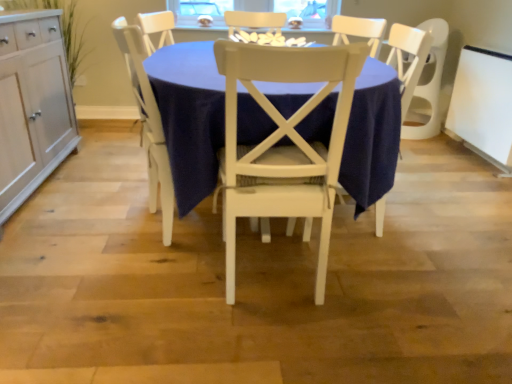
Question: Could you tell me if white glossy cookies at center is turned towards white wood chair at center?

Choices:
 (A) no
 (B) yes

Answer: (A)

Question: From a real-world perspective, is white glossy cookies at center positioned under white wood chair at center based on gravity?

Choices:
 (A) no
 (B) yes

Answer: (A)

Question: Is white glossy cookies at center oriented away from white wood chair at center?

Choices:
 (A) no
 (B) yes

Answer: (A)

Question: Can you confirm if white glossy cookies at center is smaller than white wood chair at center?

Choices:
 (A) no
 (B) yes

Answer: (B)

Question: Is there a large distance between white glossy cookies at center and white wood chair at center?

Choices:
 (A) no
 (B) yes

Answer: (A)

Question: From their relative heights in the image, would you say white wood chair at center is taller or shorter than white painted wood chair at center, placed as the 2th chair when sorted from left to right?

Choices:
 (A) short
 (B) tall

Answer: (B)

Question: From a real-world perspective, is white wood chair at center above or below white painted wood chair at center, placed as the 2th chair when sorted from left to right?

Choices:
 (A) above
 (B) below

Answer: (B)

Question: From the image's perspective, is white wood chair at center positioned above or below white painted wood chair at center, placed as the 2th chair when sorted from left to right?

Choices:
 (A) below
 (B) above

Answer: (B)

Question: In the image, is white wood chair at center on the left side or the right side of white painted wood chair at center, arranged as the 1th chair when viewed from the right?

Choices:
 (A) left
 (B) right

Answer: (B)

Question: From their relative heights in the image, would you say white wood chair at center is taller or shorter than white wood cabinet at left?

Choices:
 (A) tall
 (B) short

Answer: (A)

Question: From the image's perspective, is white wood chair at center located above or below white wood cabinet at left?

Choices:
 (A) below
 (B) above

Answer: (A)

Question: Is point pyautogui.click(x=404, y=49) closer or farther from the camera than point pyautogui.click(x=33, y=188)?

Choices:
 (A) closer
 (B) farther

Answer: (A)

Question: Is white wood chair at center in front of or behind white wood cabinet at left in the image?

Choices:
 (A) front
 (B) behind

Answer: (B)

Question: In terms of height, does white glossy cookies at center look taller or shorter compared to white wood cabinet at left?

Choices:
 (A) short
 (B) tall

Answer: (A)

Question: Is white glossy cookies at center bigger or smaller than white wood cabinet at left?

Choices:
 (A) small
 (B) big

Answer: (A)